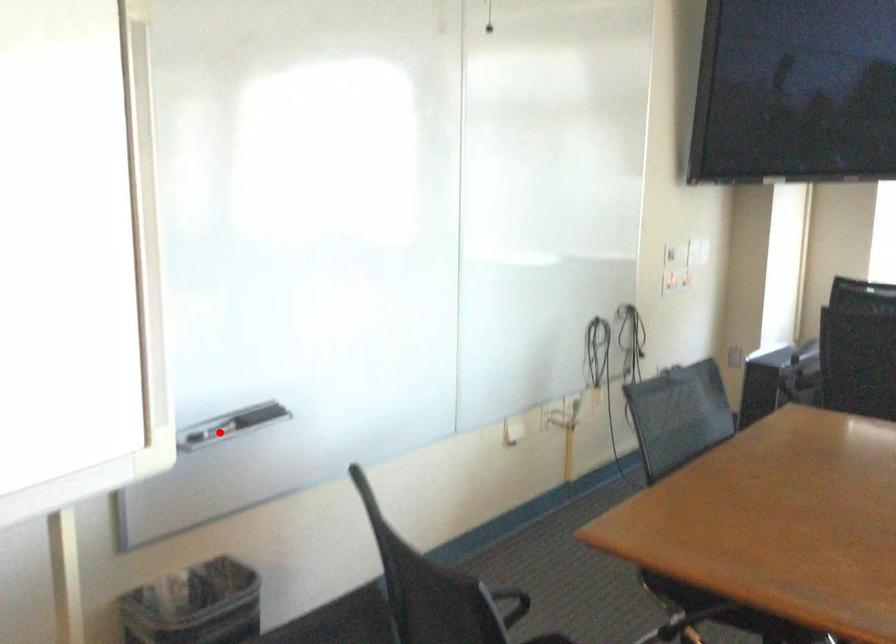
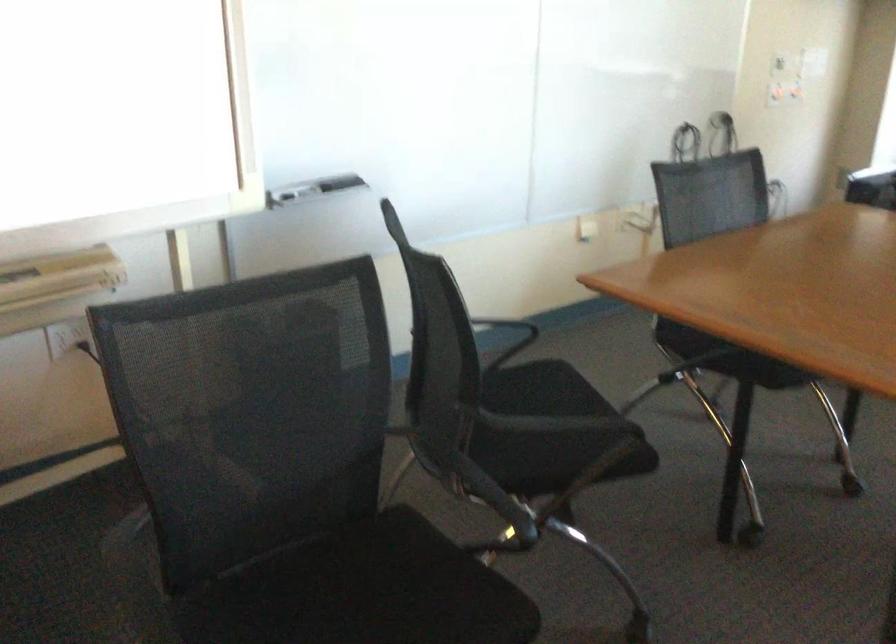
Question: I am providing you with two images of the same scene from different viewpoints. Given a red point in image1, look at the same physical point in image2. Is it:

Choices:
 (A) Closer to the viewpoint
 (B) Farther from the viewpoint

Answer: (B)